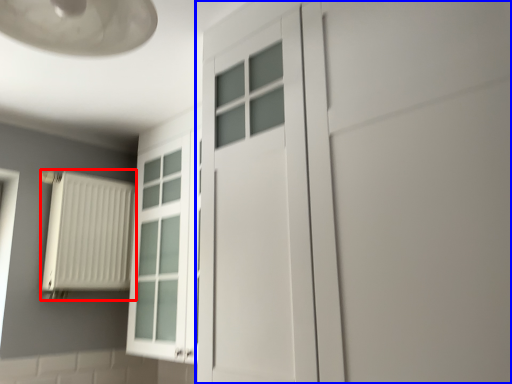
Question: Among these objects, which one is nearest to the camera, radiator (highlighted by a red box) or door (highlighted by a blue box)?

Choices:
 (A) radiator
 (B) door

Answer: (B)